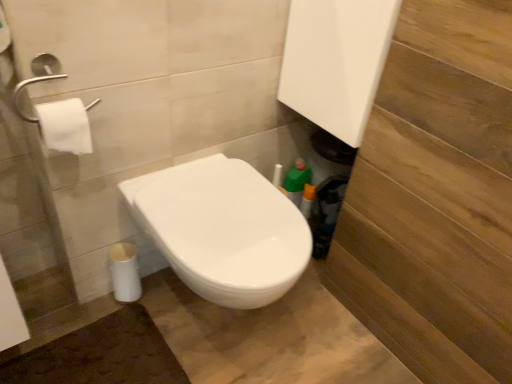
Question: Should I look upward or downward to see white matte toilet paper at upper left?

Choices:
 (A) down
 (B) up

Answer: (B)

Question: Is white glossy toilet at center a part of white matte toilet paper at upper left?

Choices:
 (A) no
 (B) yes

Answer: (A)

Question: Is white matte toilet paper at upper left positioned with its back to white glossy toilet at center?

Choices:
 (A) yes
 (B) no

Answer: (B)

Question: Is white matte toilet paper at upper left shorter than white glossy toilet at center?

Choices:
 (A) no
 (B) yes

Answer: (B)

Question: From the image's perspective, does white matte toilet paper at upper left appear lower than white glossy toilet at center?

Choices:
 (A) no
 (B) yes

Answer: (A)

Question: Is white matte toilet paper at upper left in front of white glossy toilet at center?

Choices:
 (A) yes
 (B) no

Answer: (B)

Question: Is white matte toilet paper at upper left behind white glossy toilet at center?

Choices:
 (A) no
 (B) yes

Answer: (B)

Question: Is white glossy toilet at center to the left of white matte toilet paper at upper left from the viewer's perspective?

Choices:
 (A) yes
 (B) no

Answer: (B)

Question: Is white glossy toilet at center placed right next to white matte toilet paper at upper left?

Choices:
 (A) yes
 (B) no

Answer: (B)

Question: Considering the relative sizes of white glossy toilet at center and white matte toilet paper at upper left in the image provided, is white glossy toilet at center taller than white matte toilet paper at upper left?

Choices:
 (A) yes
 (B) no

Answer: (A)

Question: Is white glossy toilet at center far away from white matte toilet paper at upper left?

Choices:
 (A) yes
 (B) no

Answer: (B)

Question: From a real-world perspective, is white glossy toilet at center located beneath white matte toilet paper at upper left?

Choices:
 (A) no
 (B) yes

Answer: (B)

Question: From a real-world perspective, is white glossy toilet at center located higher than white matte toilet paper at upper left?

Choices:
 (A) no
 (B) yes

Answer: (A)

Question: Do you think white glossy toilet at center is within white matte toilet paper at upper left, or outside of it?

Choices:
 (A) inside
 (B) outside

Answer: (B)